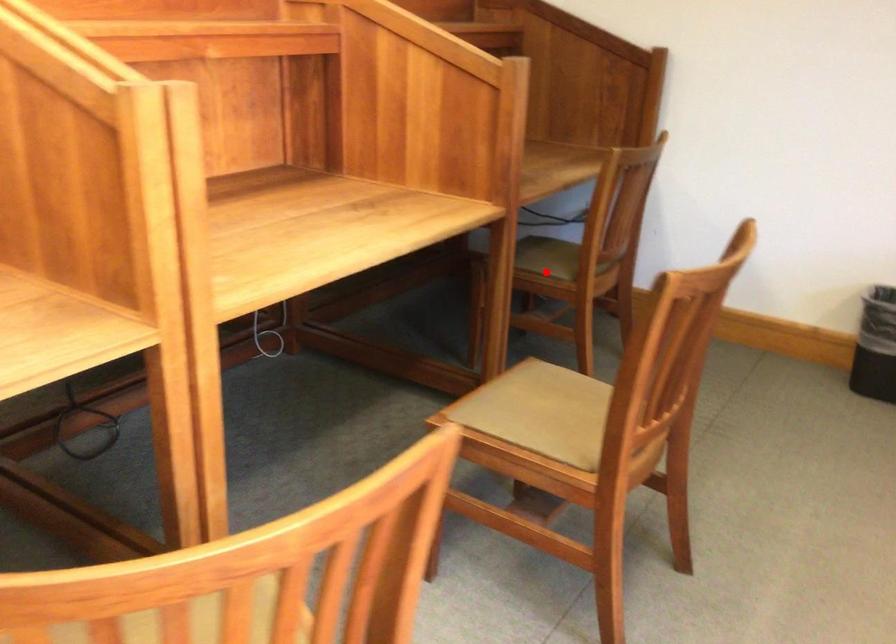
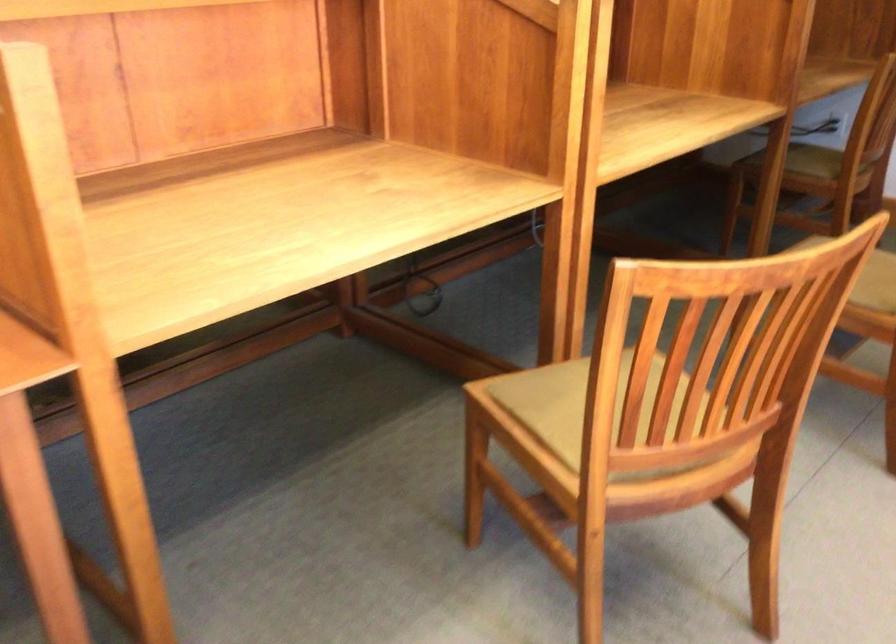
Where in the second image is the point corresponding to the highlighted location from the first image?

(814, 161)